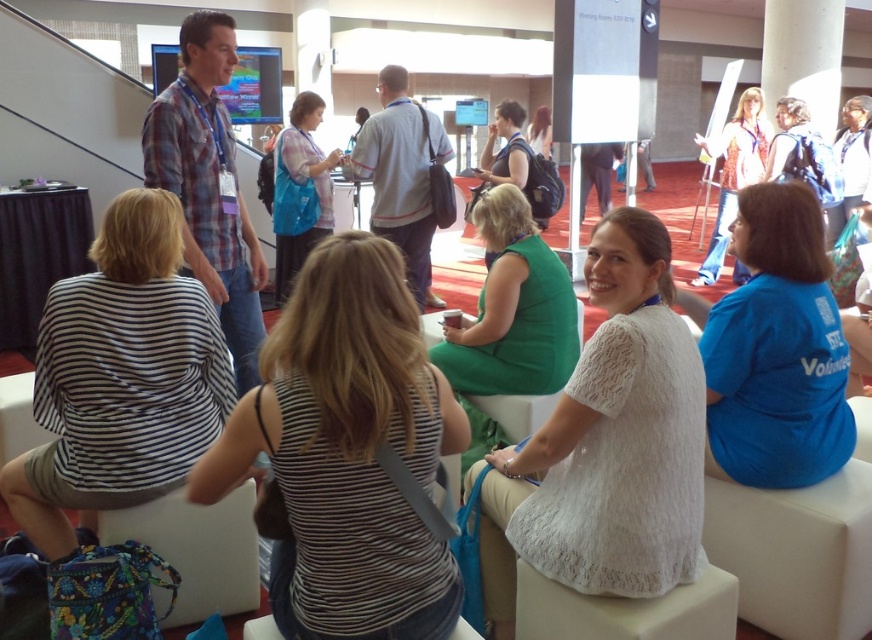
Is blue cotton shirt at right wider than white shirt at upper right?

No.

Which is behind, point (726, 300) or point (739, 136)?

Positioned behind is point (739, 136).

Does point (802, 385) come behind point (748, 168)?

No, it is not.

The height and width of the screenshot is (640, 872). Find the location of `blue cotton shirt at right`. blue cotton shirt at right is located at coordinates (775, 349).

Does white lace dress at center appear on the left side of green fabric dress at center?

In fact, white lace dress at center is to the right of green fabric dress at center.

In the scene shown: Can you confirm if white lace dress at center is shorter than green fabric dress at center?

Incorrect, white lace dress at center's height does not fall short of green fabric dress at center's.

Who is more forward, (615, 348) or (516, 314)?

Point (615, 348) is in front.

I want to click on white lace dress at center, so click(607, 445).

Is striped fabric shirt at left bigger than blue cotton shirt at right?

Correct, striped fabric shirt at left is larger in size than blue cotton shirt at right.

Is striped fabric shirt at left closer to camera compared to blue cotton shirt at right?

Yes, it is in front of blue cotton shirt at right.

What do you see at coordinates (120, 378) in the screenshot?
I see `striped fabric shirt at left` at bounding box center [120, 378].

I want to click on striped fabric shirt at left, so click(120, 378).